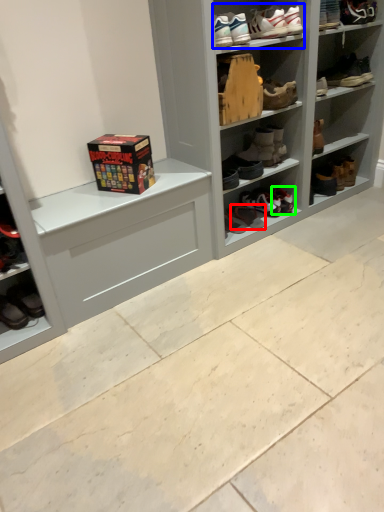
Question: Which object is positioned closest to footwear (highlighted by a red box)? Select from footwear (highlighted by a blue box) and footwear (highlighted by a green box).

Choices:
 (A) footwear
 (B) footwear

Answer: (B)